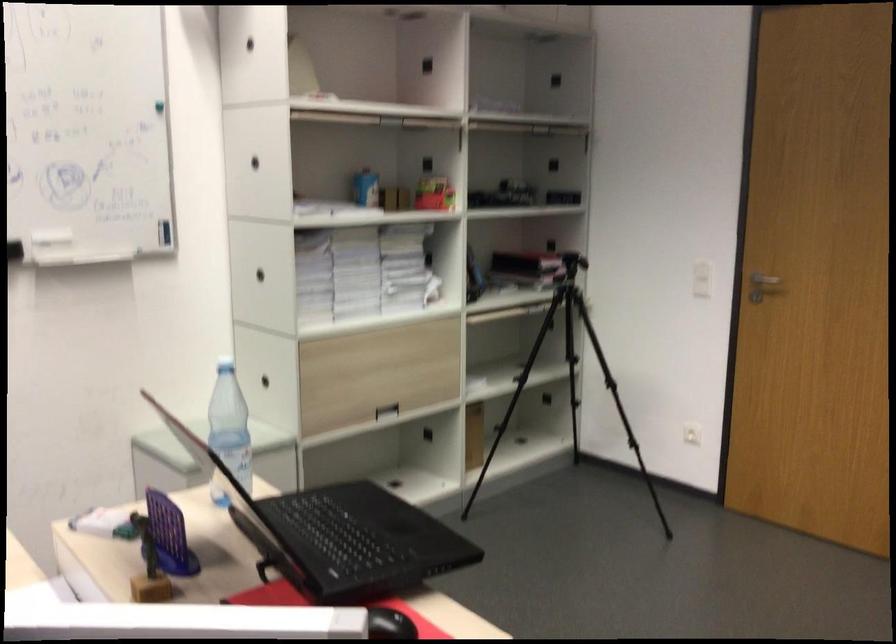
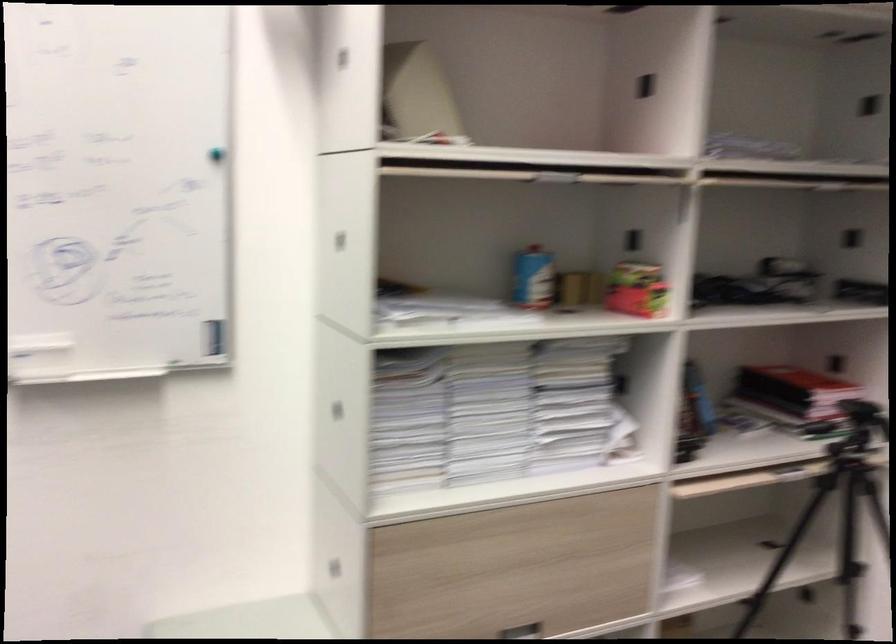
Locate, in the second image, the point that corresponds to point (437, 192) in the first image.

(636, 289)